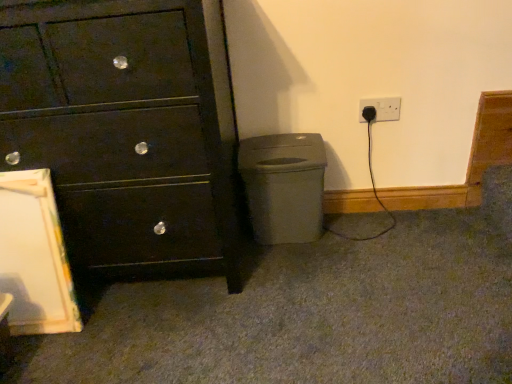
Locate an element on the screen. This screenshot has height=384, width=512. vacant area that is in front of matte gray plastic at lower right is located at coordinates pyautogui.click(x=297, y=262).